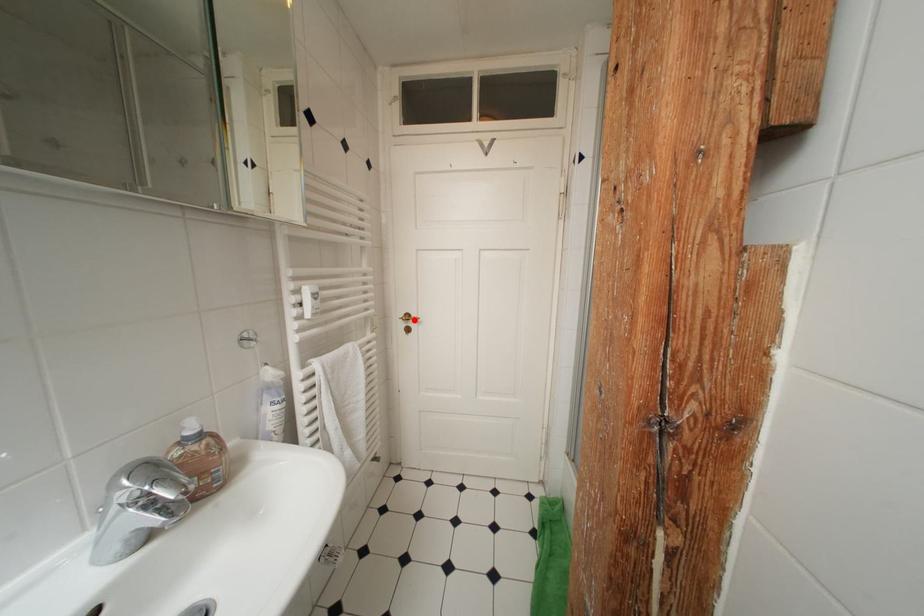
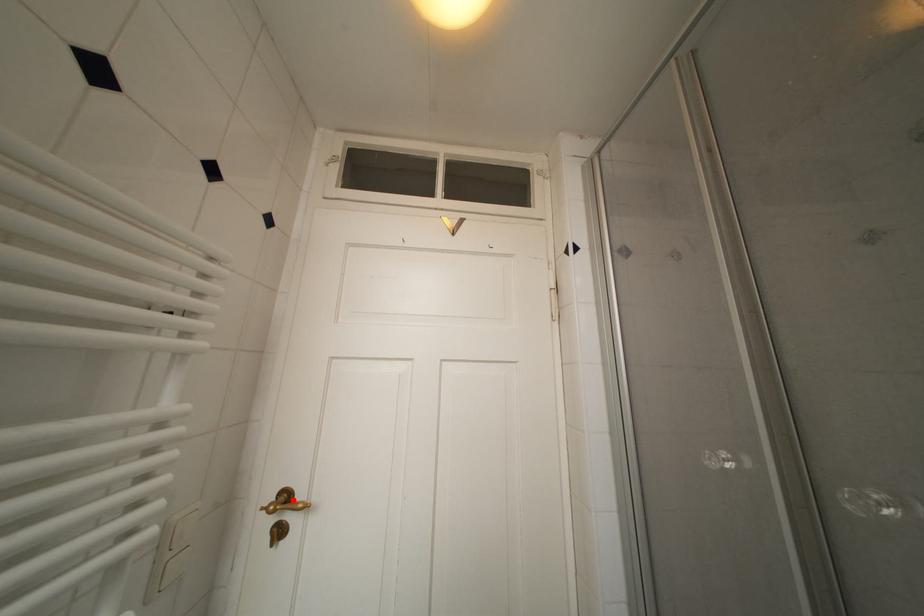
I am providing you with two images of the same scene from different viewpoints. A red point is marked on the first image and another point is marked on the second image. Is the red point in image1 aligned with the point shown in image2?

Yes